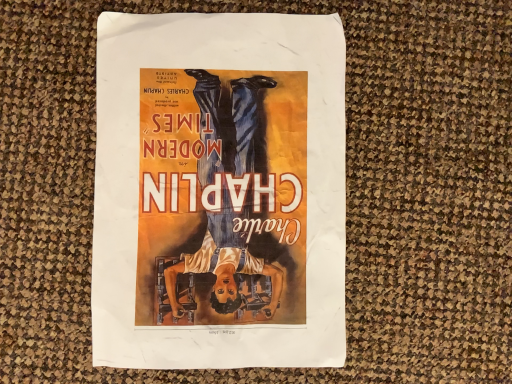
Where is `matte paper poster at center`? matte paper poster at center is located at coordinates (219, 191).

Image resolution: width=512 pixels, height=384 pixels. Describe the element at coordinates (219, 191) in the screenshot. I see `matte paper poster at center` at that location.

Locate an element on the screen. matte paper poster at center is located at coordinates (219, 191).